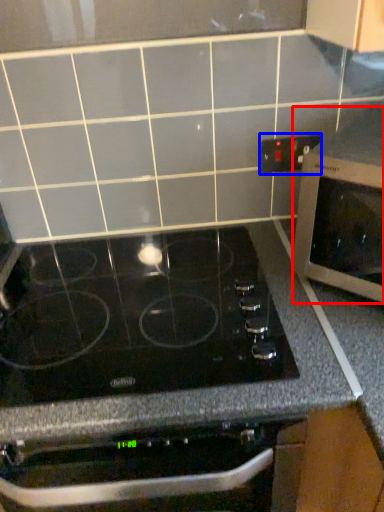
Question: Which of the following is the closest to the observer, microwave oven (highlighted by a red box) or electric outlet (highlighted by a blue box)?

Choices:
 (A) microwave oven
 (B) electric outlet

Answer: (A)